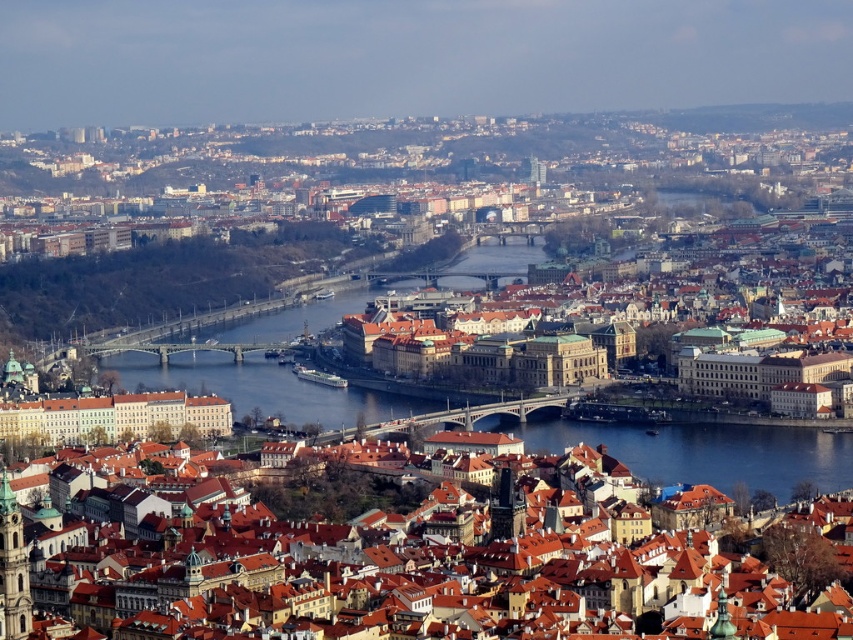
You are a photographer planning to capture the cityscape of Prague focusing on the Vltava River. You have two types of water reflections in view, the clear blue water at center and the blue glass water at center. Which water type would allow you to see the reflections of the buildings more clearly?

The clear blue water at center is wider than the blue glass water at center, so it would allow you to see the reflections of the buildings more clearly.

You are an architect designing a new bridge over the Vltava River in the cityscape. You need to ensure the bridge will be visible from the foreground buildings. Based on the image, which water feature should the bridge be placed over to ensure visibility? The clear blue water at center or the blue glass water at center?

The clear blue water at center is positioned over the blue glass water at center. To ensure visibility from the foreground buildings, the bridge should be placed over the clear blue water at center as it is higher and more prominent in the scene.

You are a drone operator who needs to fly a drone from the clear blue water at center to the blue glass water at center. The drone has a maximum flight range of 50 meters. Can the drone make this trip without needing to recharge?

The distance between the clear blue water at center and the blue glass water at center is 60.09 meters, which exceeds the drone operator has a maximum flight range of 50 meters. The drone cannot complete the trip without recharging.